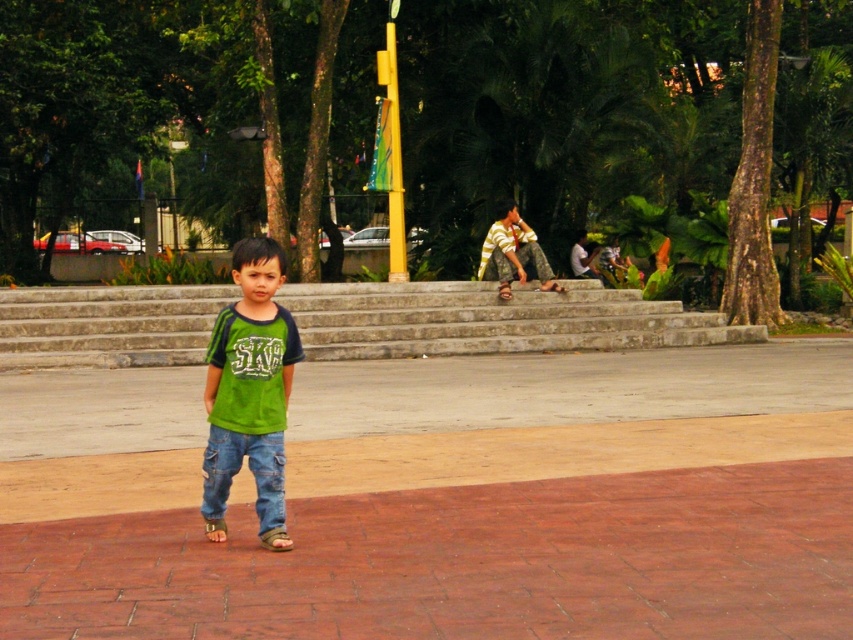
Measure the distance between gray stone stairs at center and camera.

They are 51.96 feet apart.

Who is taller, gray stone stairs at center or denim pants at center?

With more height is gray stone stairs at center.

Is point (567, 314) farther from viewer compared to point (210, 516)?

That is True.

The image size is (853, 640). In order to click on gray stone stairs at center in this screenshot , I will do `click(491, 321)`.

Is brown brick pavement at center smaller than denim pants at center?

Actually, brown brick pavement at center might be larger than denim pants at center.

The height and width of the screenshot is (640, 853). Identify the location of brown brick pavement at center. (445, 499).

Is point (212, 504) closer to camera compared to point (508, 252)?

Yes, point (212, 504) is closer to viewer.

Which is in front, point (262, 536) or point (509, 232)?

Point (262, 536) is in front.

Does point (219, 509) come in front of point (514, 212)?

Yes.

Where is `denim pants at center`? This screenshot has height=640, width=853. denim pants at center is located at coordinates (252, 474).